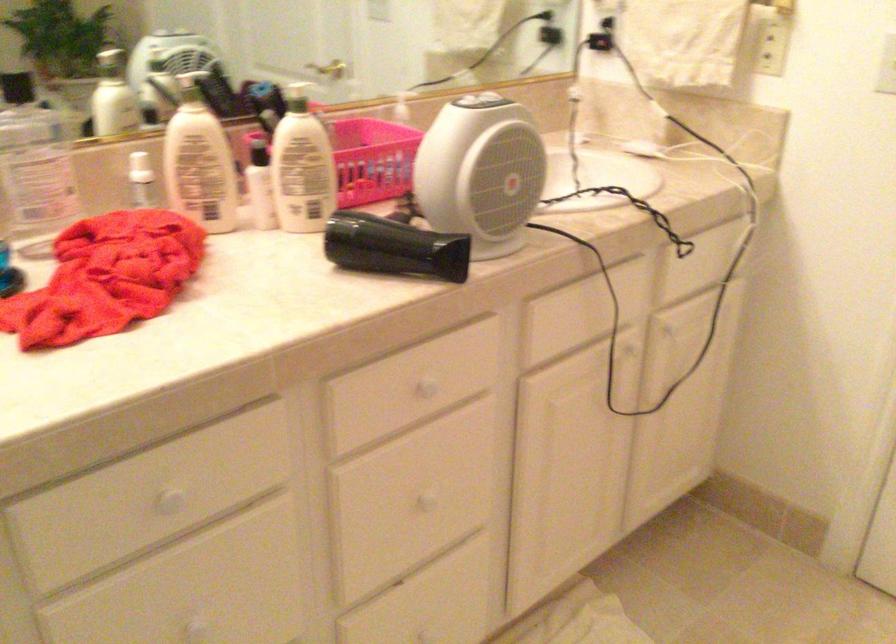
Find where to plugg the electrical socket. Please return your answer as a coordinate pair (x, y).

(771, 46)